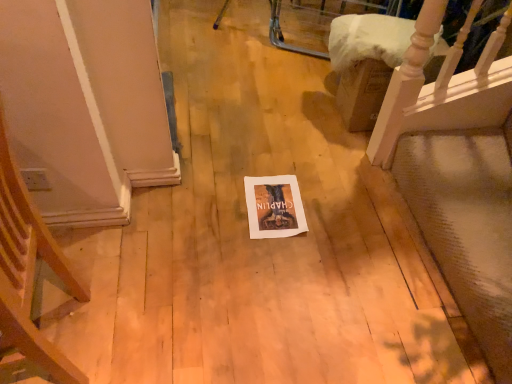
What are the coordinates of `vacant area that is situated to the right of white paper at center` in the screenshot? It's located at (337, 210).